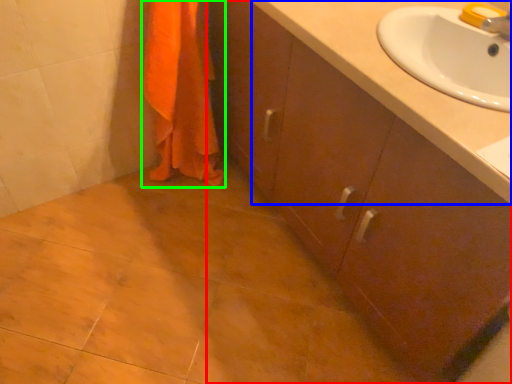
Question: Based on their relative distances, which object is farther from bathroom cabinet (highlighted by a red box)? Choose from counter top (highlighted by a blue box) and bath towel (highlighted by a green box).

Choices:
 (A) counter top
 (B) bath towel

Answer: (B)